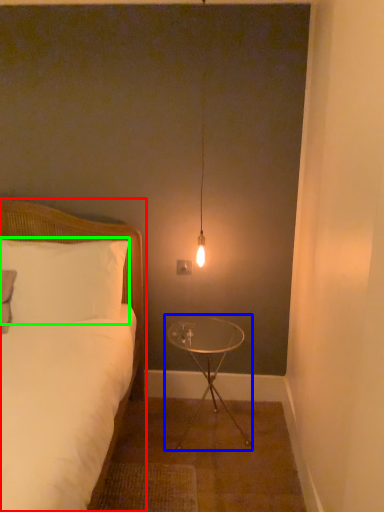
Question: Based on their relative distances, which object is farther from bed (highlighted by a red box)? Choose from table (highlighted by a blue box) and pillow (highlighted by a green box).

Choices:
 (A) table
 (B) pillow

Answer: (A)